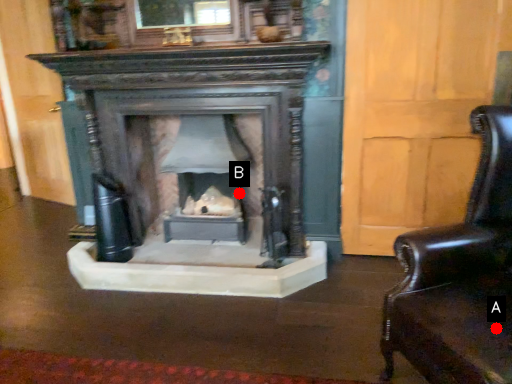
Question: Two points are circled on the image, labeled by A and B beside each circle. Which point is closer to the camera taking this photo?

Choices:
 (A) A is closer
 (B) B is closer

Answer: (A)